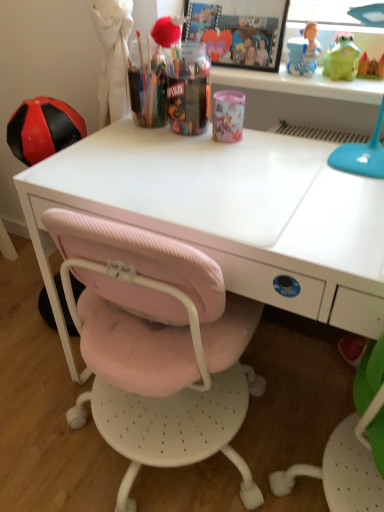
Locate an element on the screen. The height and width of the screenshot is (512, 384). free space to the left of translucent plastic container at center, arranged as the 1th stationery when viewed from the left is located at coordinates (122, 139).